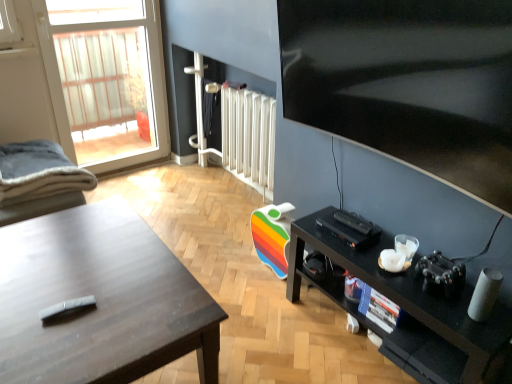
Locate an element on the screen. vacant position to the left of black matte shelf at lower right is located at coordinates (275, 330).